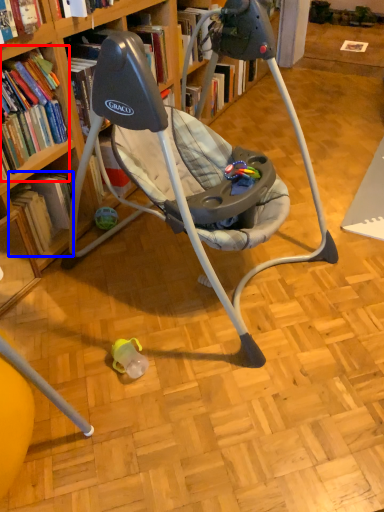
Question: Which object is further to the camera taking this photo, book (highlighted by a red box) or book (highlighted by a blue box)?

Choices:
 (A) book
 (B) book

Answer: (B)